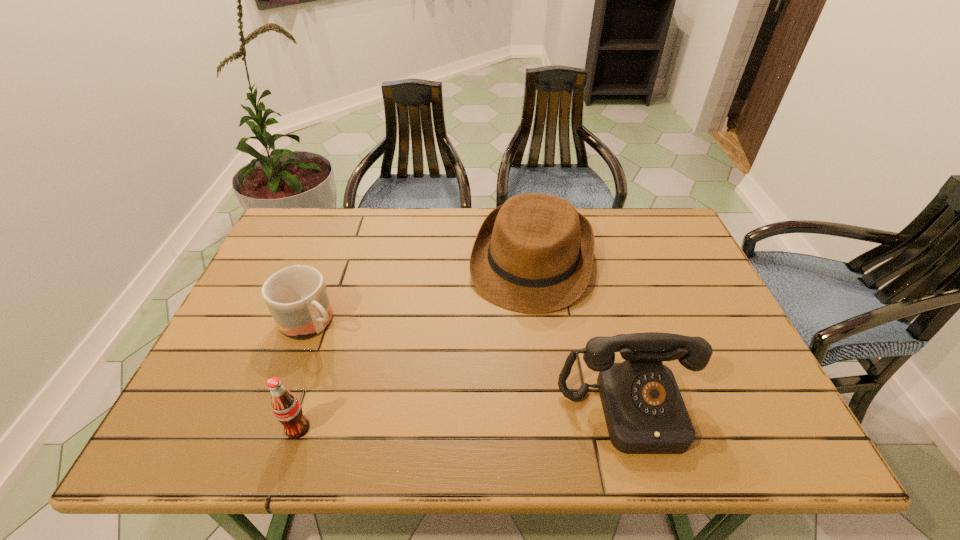
I want to click on free space on the desktop that is between the soda and the telephone and is positioned on the front-facing side of the fedora, so click(x=491, y=418).

I want to click on free space on the desktop that is between the soda and the telephone and is positioned on the side with the handle of the mug, so click(435, 421).